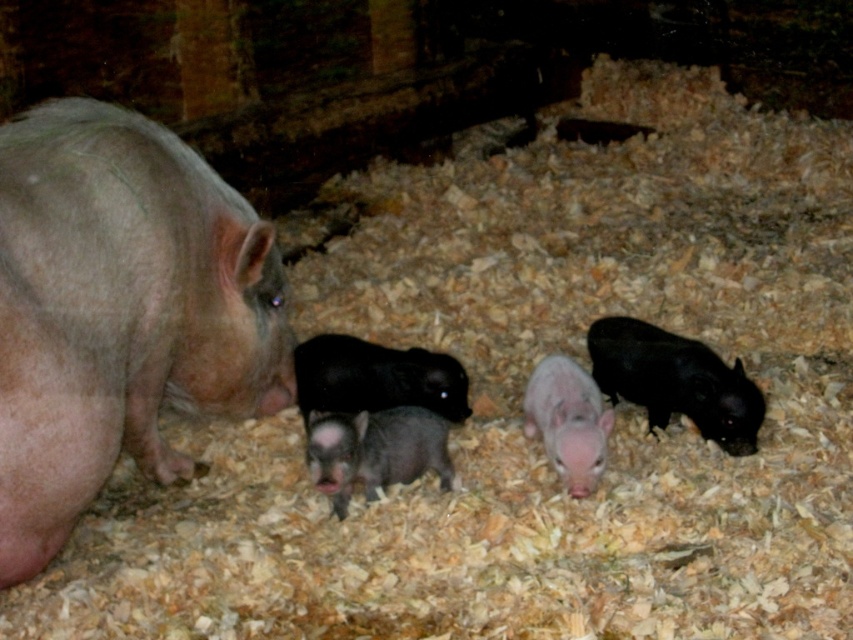
Question: In this image, where is black matte piglet at right located relative to smooth pink piglet at center?

Choices:
 (A) left
 (B) right

Answer: (B)

Question: Which of the following is the farthest from the observer?

Choices:
 (A) (22, 529)
 (B) (608, 406)

Answer: (B)

Question: Which of the following is the farthest from the observer?

Choices:
 (A) (625, 340)
 (B) (62, 172)
 (C) (541, 396)

Answer: (A)

Question: Does pink matte pig at left come in front of black matte piglet at right?

Choices:
 (A) no
 (B) yes

Answer: (B)

Question: Is the position of black matte piglet at right less distant than that of smooth pink piglet at center?

Choices:
 (A) yes
 (B) no

Answer: (B)

Question: Among these objects, which one is farthest from the camera?

Choices:
 (A) pink matte pig at left
 (B) smooth pink piglet at center
 (C) black matte piglet at right

Answer: (C)